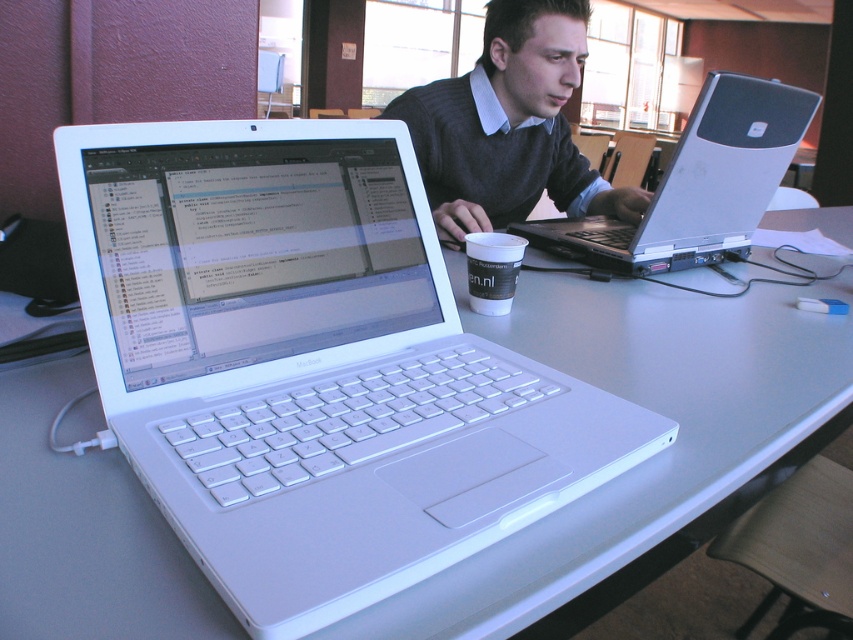
Question: Which point appears farthest from the camera in this image?

Choices:
 (A) (476, 268)
 (B) (752, 221)

Answer: (B)

Question: Which object is closer to the camera taking this photo?

Choices:
 (A) silver metallic laptop at center
 (B) white paper cup at center

Answer: (B)

Question: Is silver metallic laptop at center to the left of white paper cup at center from the viewer's perspective?

Choices:
 (A) no
 (B) yes

Answer: (A)

Question: Does white plastic table at center have a greater width compared to dark gray sweater at center?

Choices:
 (A) yes
 (B) no

Answer: (A)

Question: Based on their relative distances, which object is farther from the white plastic table at center?

Choices:
 (A) dark gray sweater at center
 (B) white paper cup at center
 (C) silver metallic laptop at center

Answer: (A)

Question: Can you confirm if silver metallic laptop at center is thinner than white paper cup at center?

Choices:
 (A) yes
 (B) no

Answer: (B)